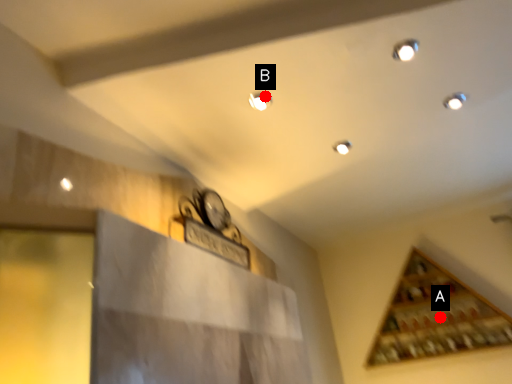
Question: Two points are circled on the image, labeled by A and B beside each circle. Which point appears farthest from the camera in this image?

Choices:
 (A) A is further
 (B) B is further

Answer: (A)